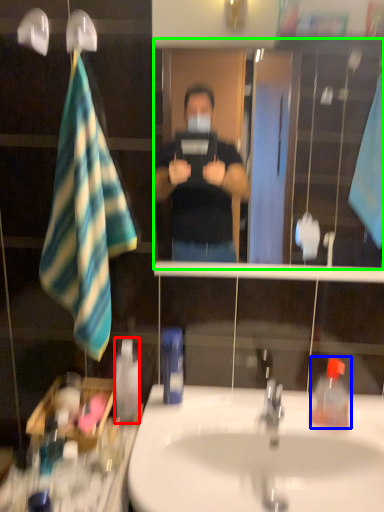
Question: Estimate the real-world distances between objects in this image. Which object is closer to mouthwash (highlighted by a red box), toiletry (highlighted by a blue box) or mirror (highlighted by a green box)?

Choices:
 (A) toiletry
 (B) mirror

Answer: (A)